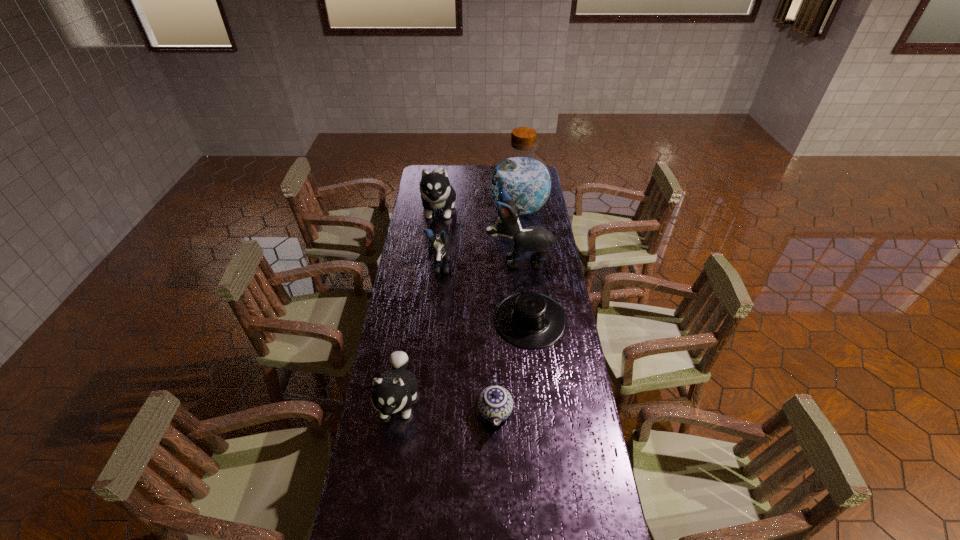
You are a GUI agent. You are given a task and a screenshot of the screen. Output one action in this format:
    pyautogui.click(x=<x>, y=<y>)
    Task: Click on the water jug
    The image size is (960, 540).
    Given the screenshot: What is the action you would take?
    pyautogui.click(x=527, y=179)

The width and height of the screenshot is (960, 540). What are the coordinates of `blue water jug` in the screenshot? It's located at coord(527,179).

You are a GUI agent. You are given a task and a screenshot of the screen. Output one action in this format:
    pyautogui.click(x=<x>, y=<y>)
    Task: Click on the sixth shortest object
    Image resolution: width=960 pixels, height=540 pixels.
    Given the screenshot: What is the action you would take?
    [535, 238]

This screenshot has height=540, width=960. What are the coordinates of `the tallest puppy` in the screenshot? It's located at (535, 238).

This screenshot has width=960, height=540. Identify the location of the farthest puppy. (436, 192).

Image resolution: width=960 pixels, height=540 pixels. I want to click on the farther white puppy, so click(x=436, y=192).

Where is `the left black puppy`? The image size is (960, 540). the left black puppy is located at coordinates (440, 243).

Find the location of a particular element. The width and height of the screenshot is (960, 540). the third shortest object is located at coordinates pyautogui.click(x=395, y=390).

Locate an element on the screen. This screenshot has height=540, width=960. the shortest puppy is located at coordinates (395, 390).

Where is `chinaware`? chinaware is located at coordinates (495, 404).